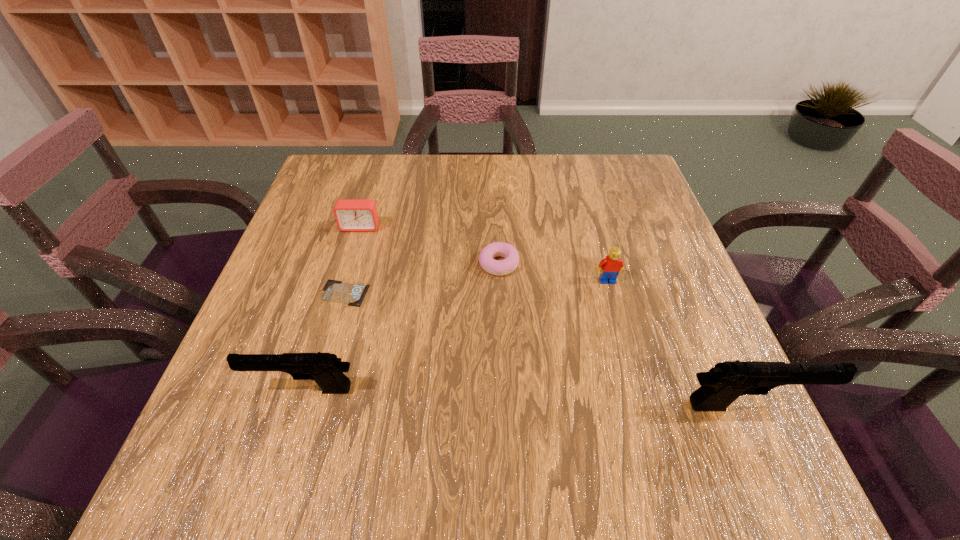
Where is `vacant space positioned 0.350m on the back of the identity card`? vacant space positioned 0.350m on the back of the identity card is located at coordinates (375, 187).

The height and width of the screenshot is (540, 960). In order to click on vacant space situated on the left of the fourth object from left to right in this screenshot , I will do `click(381, 264)`.

Locate an element on the screen. The height and width of the screenshot is (540, 960). blank space located on the front-facing side of the third shortest object is located at coordinates (328, 333).

I want to click on vacant space located 0.160m on the face of the second object from right to left, so click(625, 346).

You are a GUI agent. You are given a task and a screenshot of the screen. Output one action in this format:
    pyautogui.click(x=<x>, y=<y>)
    Task: Click on the pistol at the left edge
    The width and height of the screenshot is (960, 540).
    Given the screenshot: What is the action you would take?
    pyautogui.click(x=325, y=369)

In order to click on identity card at the left edge in this screenshot , I will do `click(335, 291)`.

I want to click on alarm clock that is at the left edge, so click(351, 214).

Locate an element on the screen. This screenshot has width=960, height=540. pistol that is positioned at the right edge is located at coordinates (720, 386).

The height and width of the screenshot is (540, 960). I want to click on Lego present at the right edge, so click(x=610, y=267).

The image size is (960, 540). Find the location of `object located in the near left corner section of the desktop`. object located in the near left corner section of the desktop is located at coordinates (325, 369).